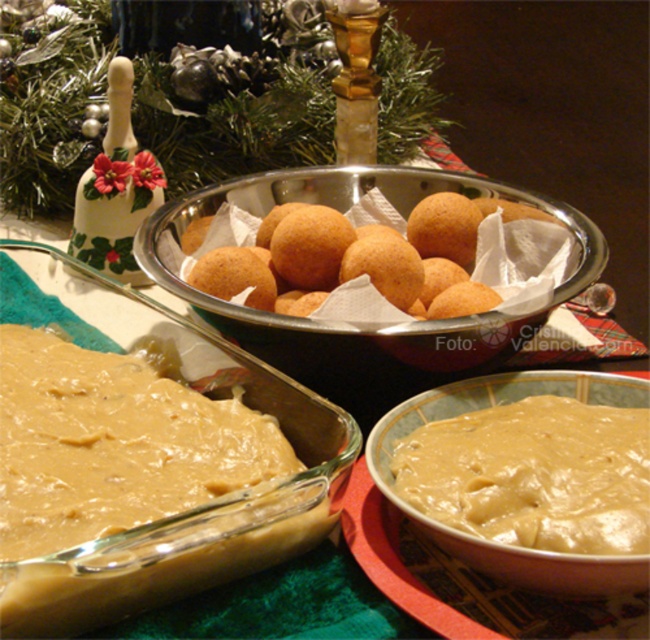
Is smooth beige paste at lower left to the right of metallic silver bowl at center from the viewer's perspective?

In fact, smooth beige paste at lower left is to the left of metallic silver bowl at center.

Does smooth beige paste at lower left appear on the left side of metallic silver bowl at center?

Correct, you'll find smooth beige paste at lower left to the left of metallic silver bowl at center.

The width and height of the screenshot is (650, 640). I want to click on smooth beige paste at lower left, so click(114, 436).

At what (x,y) coordinates should I click in order to perform the action: click on smooth beige paste at lower left. Please return your answer as a coordinate pair (x, y). Image resolution: width=650 pixels, height=640 pixels. Looking at the image, I should click on (114, 436).

Where is `golden crispy balls at center`? This screenshot has width=650, height=640. golden crispy balls at center is located at coordinates (382, 262).

Consider the image. Does golden crispy balls at center appear on the right side of metallic silver bowl at center?

Yes, golden crispy balls at center is to the right of metallic silver bowl at center.

Who is more forward, (526, 284) or (448, 179)?

Positioned in front is point (526, 284).

I want to click on golden crispy balls at center, so click(382, 262).

Does smooth beige paste at lower left have a lesser height compared to golden crispy balls at center?

Indeed, smooth beige paste at lower left has a lesser height compared to golden crispy balls at center.

Describe the element at coordinates (114, 436) in the screenshot. I see `smooth beige paste at lower left` at that location.

Where is `smooth beige paste at lower left`? Image resolution: width=650 pixels, height=640 pixels. smooth beige paste at lower left is located at coordinates (114, 436).